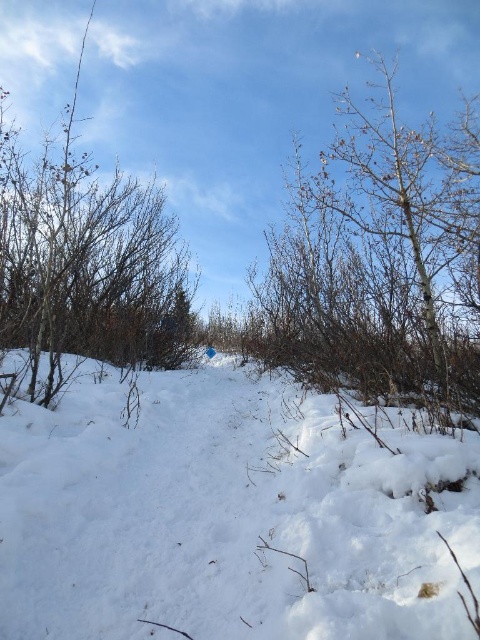
Question: Which point appears closest to the camera in this image?

Choices:
 (A) (263, 413)
 (B) (358, 312)

Answer: (A)

Question: Which of the following is the closest to the observer?

Choices:
 (A) (323, 307)
 (B) (291, 593)

Answer: (B)

Question: Can you confirm if white fluffy snow at center is positioned above bare branches at upper right?

Choices:
 (A) yes
 (B) no

Answer: (B)

Question: Which point appears farthest from the camera in this image?

Choices:
 (A) (3, 148)
 (B) (446, 348)
 (C) (389, 497)

Answer: (A)

Question: Can you confirm if bare branches at upper right is wider than brown/dry wood at left?

Choices:
 (A) yes
 (B) no

Answer: (B)

Question: Can you confirm if white fluffy snow at center is thinner than brown/dry wood at left?

Choices:
 (A) no
 (B) yes

Answer: (B)